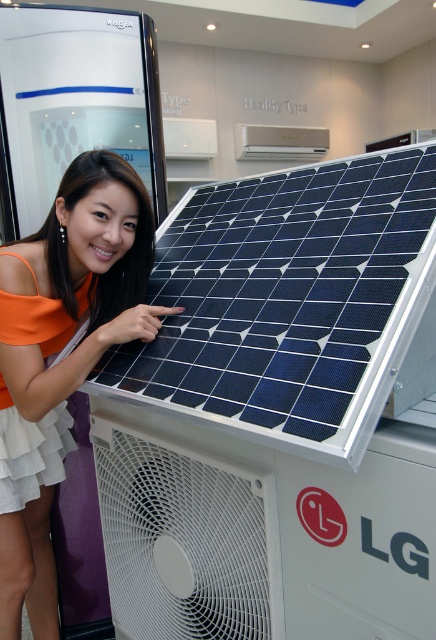
Question: Is white plastic fan at lower center to the left of white glossy air conditioner at upper center from the viewer's perspective?

Choices:
 (A) no
 (B) yes

Answer: (B)

Question: Is orange fabric dress at center to the left of white plastic fan at lower center from the viewer's perspective?

Choices:
 (A) yes
 (B) no

Answer: (A)

Question: Which of these objects is positioned farthest from the white plastic fan at lower center?

Choices:
 (A) orange fabric dress at center
 (B) white glossy air conditioner at upper center

Answer: (B)

Question: Does white plastic fan at lower center appear under white glossy air conditioner at upper center?

Choices:
 (A) no
 (B) yes

Answer: (B)

Question: Among these points, which one is farthest from the camera?

Choices:
 (A) (156, 317)
 (B) (251, 160)
 (C) (115, 586)

Answer: (B)

Question: Which object is the farthest from the orange fabric dress at center?

Choices:
 (A) white glossy air conditioner at upper center
 (B) white plastic fan at lower center

Answer: (A)